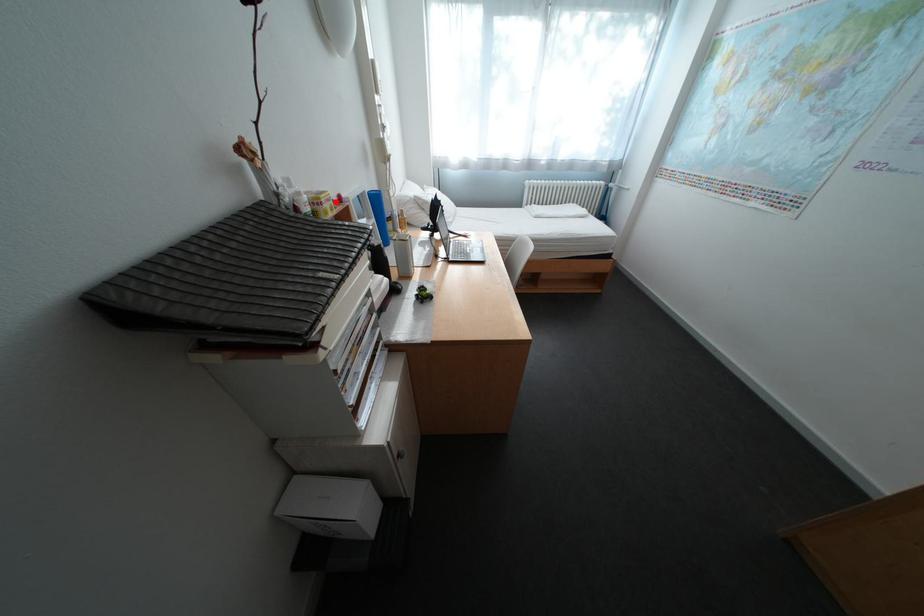
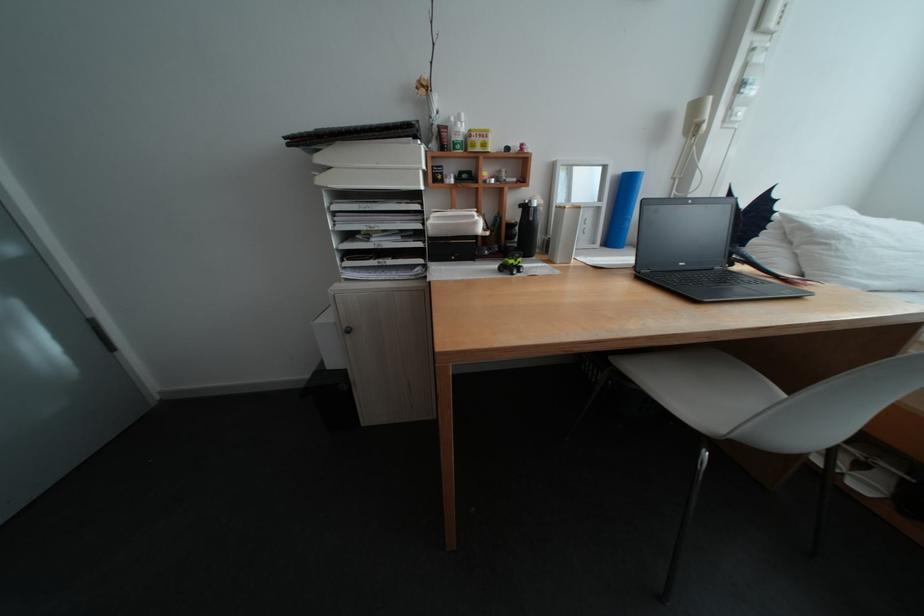
Question: I am providing you with two images of the same scene from different viewpoints. A red point is marked on the first image. At the location where the point appears in image 1, is it still visible in image 2?

Choices:
 (A) Yes
 (B) No

Answer: (A)